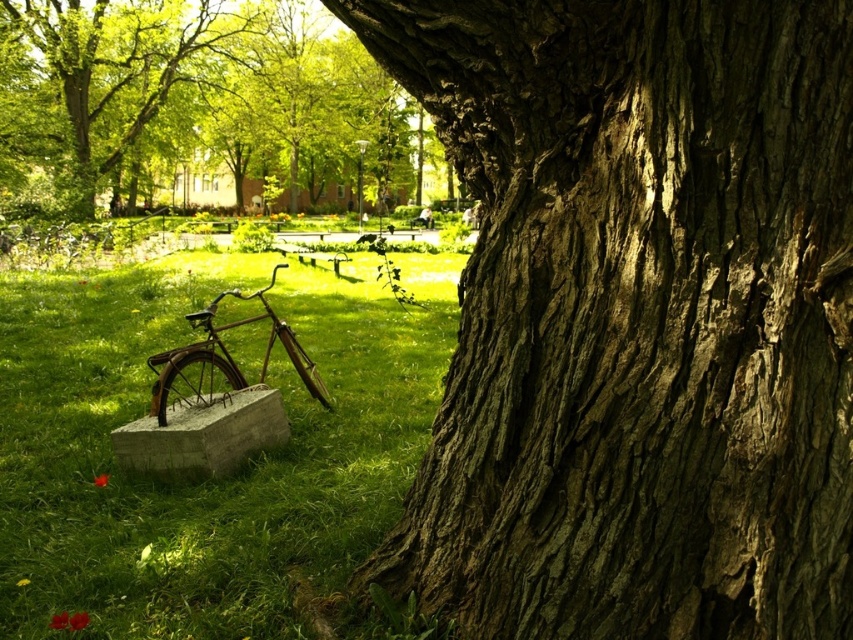
Question: Estimate the real-world distances between objects in this image. Which object is farther from the rough bark tree trunk at center?

Choices:
 (A) smooth bark tree at center
 (B) green grass at lower left

Answer: (A)

Question: Does rough bark tree trunk at center have a lesser width compared to rusty metal bicycle at lower left?

Choices:
 (A) yes
 (B) no

Answer: (B)

Question: Is rough bark tree trunk at center thinner than rusty metal bicycle at lower left?

Choices:
 (A) no
 (B) yes

Answer: (A)

Question: Which point appears closest to the camera in this image?

Choices:
 (A) (213, 99)
 (B) (200, 314)

Answer: (B)

Question: Can you confirm if rough bark tree trunk at center is wider than green grass at lower left?

Choices:
 (A) no
 (B) yes

Answer: (A)

Question: Among these points, which one is nearest to the camera?

Choices:
 (A) (311, 74)
 (B) (691, 529)
 (C) (323, 547)
 (D) (215, 339)

Answer: (B)